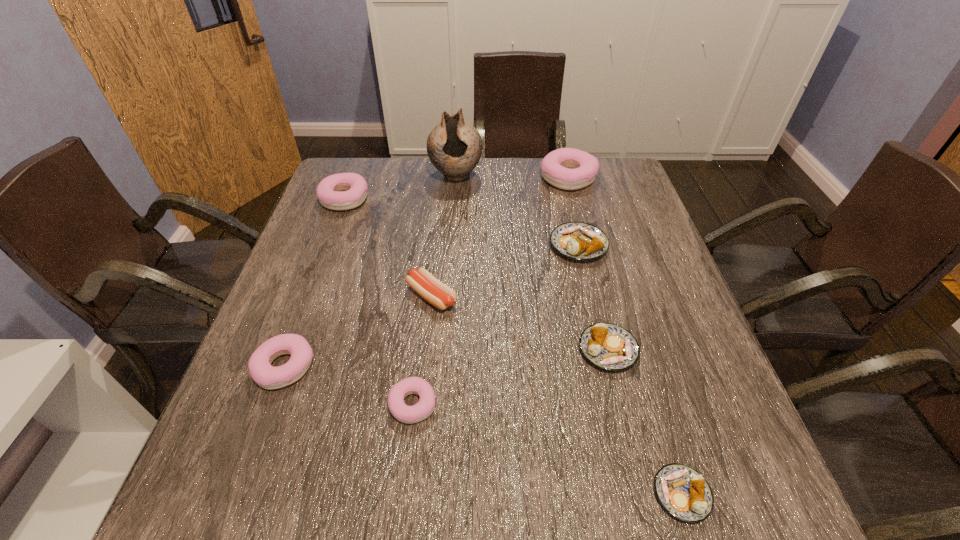
Point out which brown pastry is positioned as the second nearest to the fifth nearest object. Please provide its 2D coordinates. Your answer should be formatted as a tuple, i.e. [(x, y)], where the tuple contains the x and y coordinates of a point satisfying the conditions above.

[(608, 346)]

Locate an element on the screen. free spot that satisfies the following two spatial constraints: 1. on the front side of the brown sausage; 2. on the left side of the third smallest pink pastry is located at coordinates (308, 296).

Identify the location of free location that satisfies the following two spatial constraints: 1. from the spout of the biggest pink pastry; 2. on the left side of the pottery. This screenshot has height=540, width=960. (456, 178).